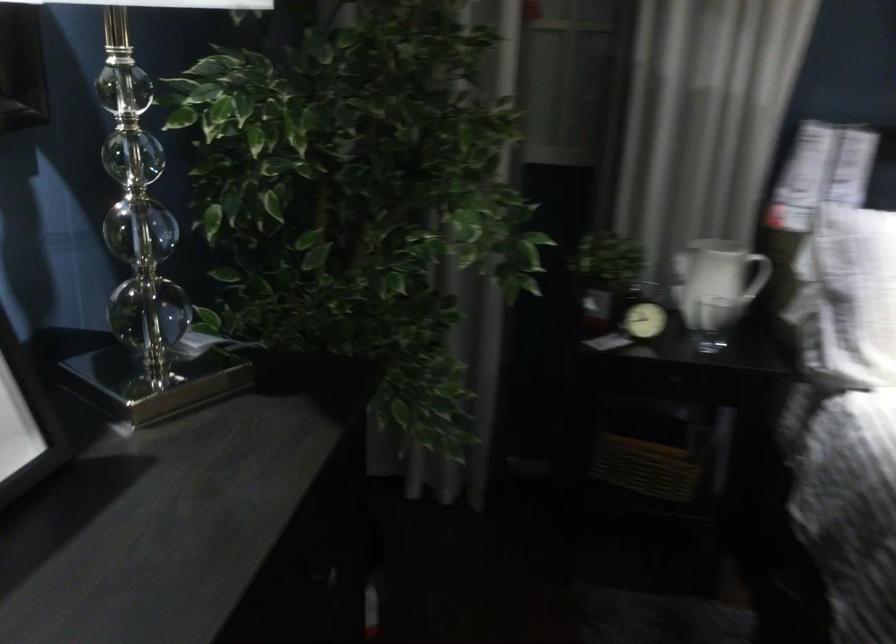
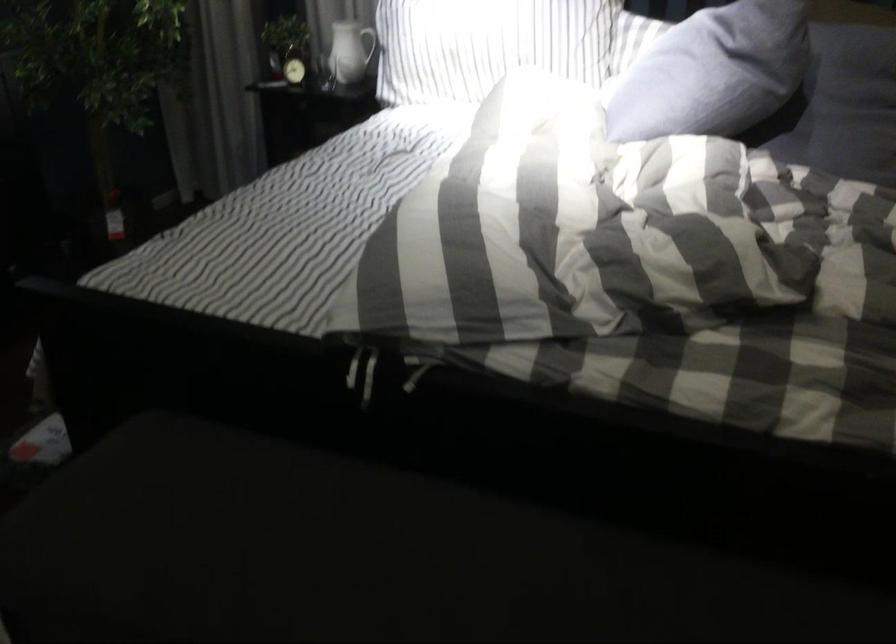
Locate, in the second image, the point that corresponds to point 655,313 in the first image.

(294, 62)